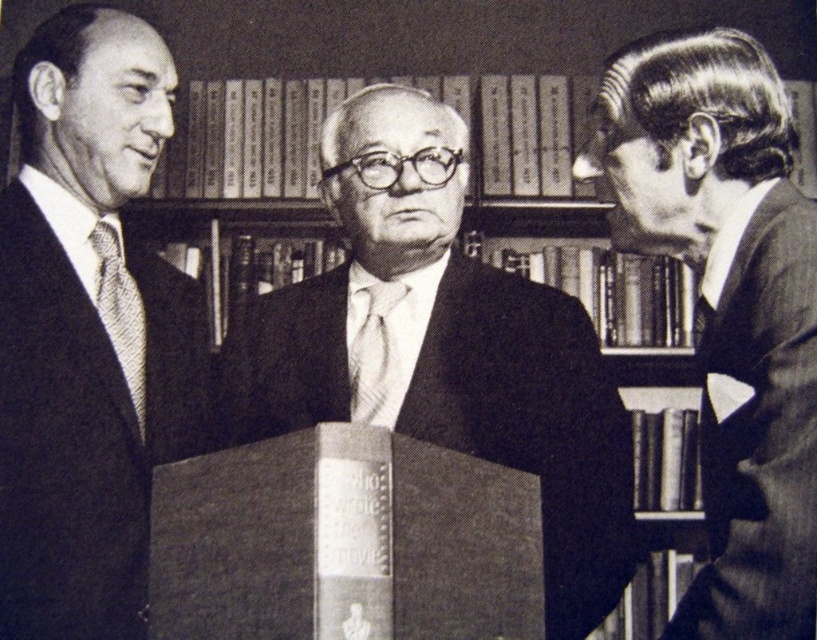
Question: Can you confirm if matte black suit at left is positioned to the left of dark gray wool suit at right?

Choices:
 (A) no
 (B) yes

Answer: (B)

Question: Is the position of matte black tie at left less distant than that of white textured tie at center?

Choices:
 (A) no
 (B) yes

Answer: (B)

Question: Can you confirm if matte black suit at left is thinner than white textured tie at center?

Choices:
 (A) no
 (B) yes

Answer: (A)

Question: Which point is closer to the camera taking this photo?

Choices:
 (A) (368, 365)
 (B) (804, 602)
 (C) (139, 420)
 (D) (74, 344)

Answer: (B)

Question: Which point is farther to the camera?

Choices:
 (A) smooth suit at right
 (B) dark gray wool suit at right

Answer: (A)

Question: Based on their relative distances, which object is nearer to the matte black suit at left?

Choices:
 (A) smooth black suit at center
 (B) dark gray wool suit at right
 (C) white textured tie at center
 (D) smooth suit at right

Answer: (A)